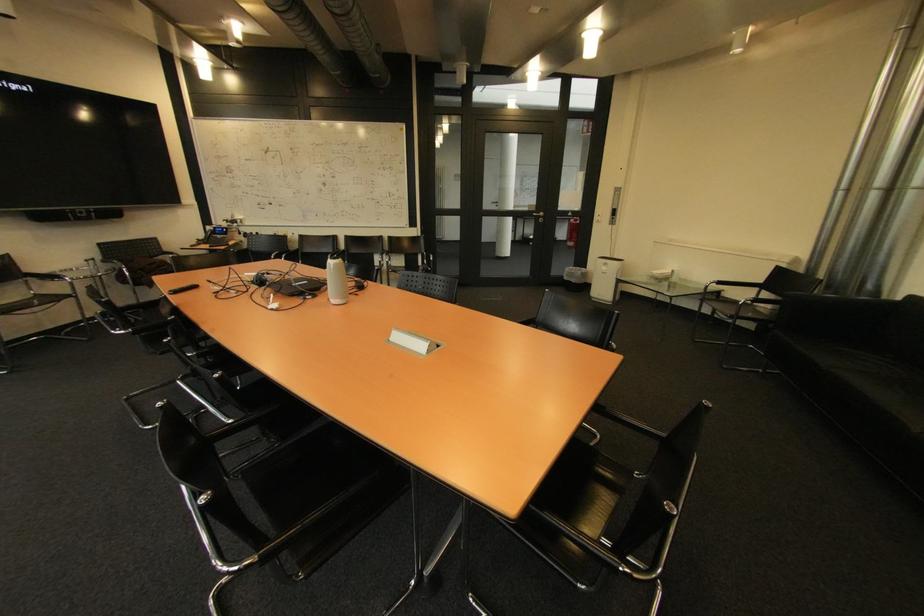
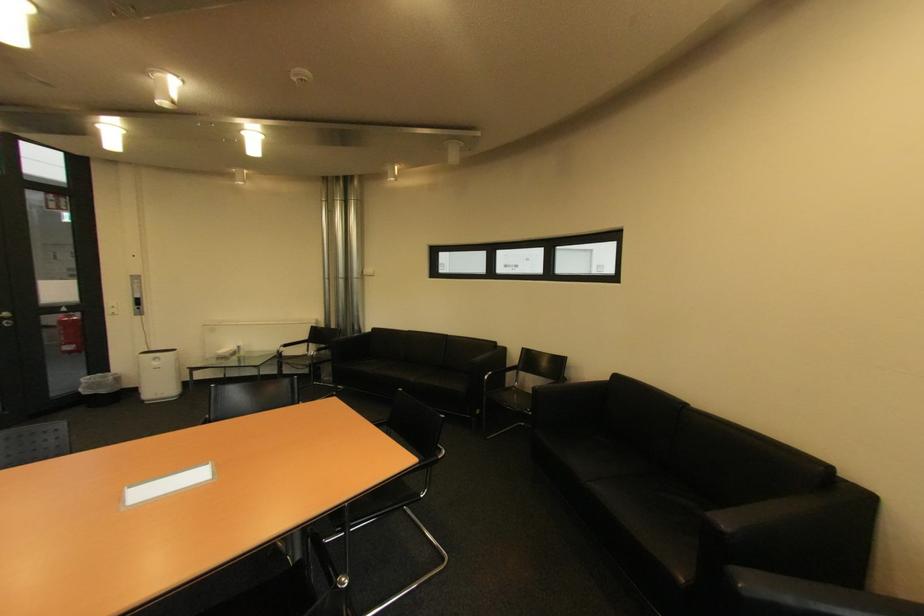
Find the pixel in the second image that matches (613,270) in the first image.

(164, 363)